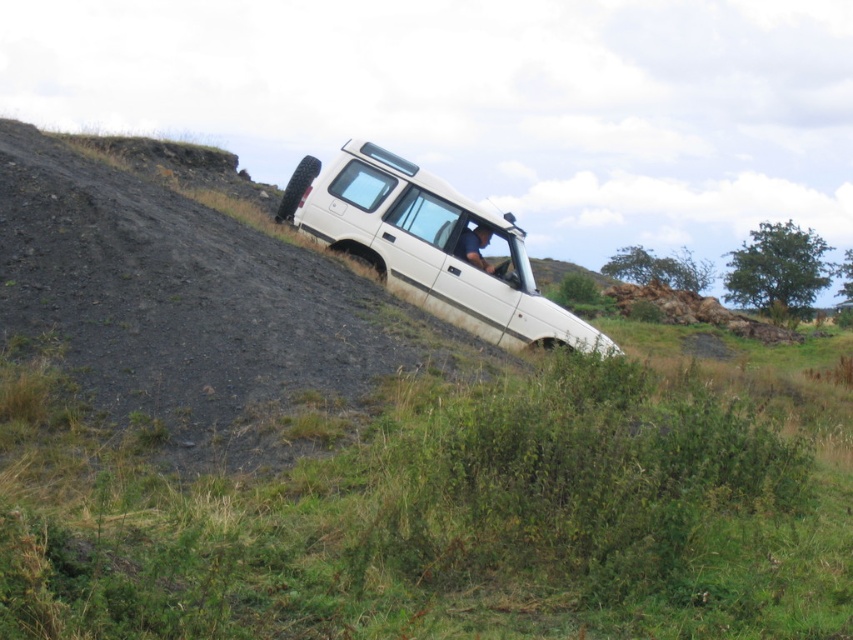
Question: Does white matte suv at center appear on the right side of dark blue fabric at center?

Choices:
 (A) yes
 (B) no

Answer: (B)

Question: Which point is farther to the camera?

Choices:
 (A) (514, 308)
 (B) (482, 269)

Answer: (B)

Question: Which object appears farthest from the camera in this image?

Choices:
 (A) dark blue fabric at center
 (B) white matte suv at center

Answer: (A)

Question: Can you confirm if white matte suv at center is positioned to the right of dark blue fabric at center?

Choices:
 (A) yes
 (B) no

Answer: (B)

Question: Is white matte suv at center behind dark blue fabric at center?

Choices:
 (A) no
 (B) yes

Answer: (A)